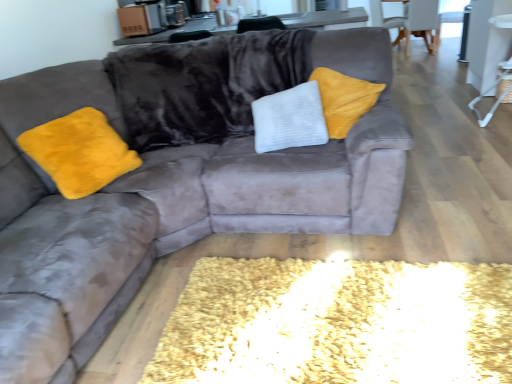
Question: Can you confirm if white plastic side table at right is bigger than velvet gray armchair at upper right, which appears as the 1th armchair when viewed from the back?

Choices:
 (A) yes
 (B) no

Answer: (B)

Question: From the image's perspective, is white plastic side table at right beneath velvet gray armchair at upper right, which appears as the 1th armchair when viewed from the back?

Choices:
 (A) no
 (B) yes

Answer: (B)

Question: Would you say white plastic side table at right contains velvet gray armchair at upper right, which appears as the 1th armchair when viewed from the back?

Choices:
 (A) yes
 (B) no

Answer: (B)

Question: Can you confirm if white plastic side table at right is positioned to the left of velvet gray armchair at upper right, which appears as the 1th armchair when viewed from the back?

Choices:
 (A) yes
 (B) no

Answer: (A)

Question: Considering the relative sizes of white plastic side table at right and velvet gray armchair at upper right, arranged as the 2th armchair when viewed from the front, in the image provided, is white plastic side table at right shorter than velvet gray armchair at upper right, arranged as the 2th armchair when viewed from the front,?

Choices:
 (A) yes
 (B) no

Answer: (B)

Question: In terms of height, does white plastic side table at right look taller or shorter compared to white fabric armchair at upper right, the second armchair when ordered from back to front?

Choices:
 (A) short
 (B) tall

Answer: (B)

Question: Considering the relative positions of white plastic side table at right and white fabric armchair at upper right, the 1th armchair from the front, in the image provided, is white plastic side table at right to the left or to the right of white fabric armchair at upper right, the 1th armchair from the front,?

Choices:
 (A) left
 (B) right

Answer: (A)

Question: From the image's perspective, is white plastic side table at right located above or below white fabric armchair at upper right, the 1th armchair from the front?

Choices:
 (A) above
 (B) below

Answer: (B)

Question: Is white plastic side table at right inside the boundaries of white fabric armchair at upper right, the 1th armchair from the front, or outside?

Choices:
 (A) inside
 (B) outside

Answer: (B)

Question: In terms of width, does white fabric armchair at upper right, the second armchair when ordered from back to front, look wider or thinner when compared to velvet gray armchair at upper right, arranged as the 2th armchair when viewed from the front?

Choices:
 (A) wide
 (B) thin

Answer: (B)

Question: Does point (422, 28) appear closer or farther from the camera than point (380, 0)?

Choices:
 (A) farther
 (B) closer

Answer: (A)

Question: Considering the positions of white fabric armchair at upper right, the 1th armchair from the front, and velvet gray armchair at upper right, arranged as the 2th armchair when viewed from the front, in the image, is white fabric armchair at upper right, the 1th armchair from the front, taller or shorter than velvet gray armchair at upper right, arranged as the 2th armchair when viewed from the front,?

Choices:
 (A) tall
 (B) short

Answer: (B)

Question: Choose the correct answer: Is white fabric armchair at upper right, the 1th armchair from the front, inside velvet gray armchair at upper right, arranged as the 2th armchair when viewed from the front, or outside it?

Choices:
 (A) inside
 (B) outside

Answer: (B)

Question: Considering the positions of white plastic side table at right and velvet gray armchair at upper right, arranged as the 2th armchair when viewed from the front, in the image, is white plastic side table at right taller or shorter than velvet gray armchair at upper right, arranged as the 2th armchair when viewed from the front,?

Choices:
 (A) tall
 (B) short

Answer: (A)

Question: From the image's perspective, is white plastic side table at right located above or below velvet gray armchair at upper right, arranged as the 2th armchair when viewed from the front?

Choices:
 (A) above
 (B) below

Answer: (B)